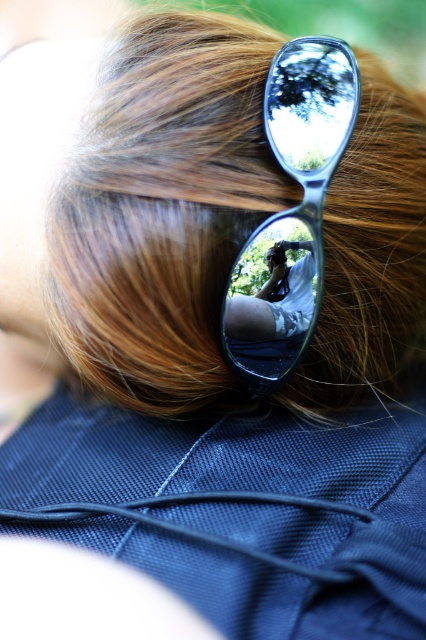
You are a photographer trying to adjust the lighting for a portrait. You notice the brown shiny hair at upper center and the metallic reflective sunglasses at center. Based on their positions, which object is closer to the left side of the frame?

The brown shiny hair at upper center is closer to the left side of the frame because it is positioned to the left of the metallic reflective sunglasses at center.

You are a photographer trying to capture the reflection in the metallic reflective sunglasses at center. The brown shiny hair at upper center is blocking part of the sunglasses. Can you adjust your position to avoid the hair blocking the reflection?

The brown shiny hair at upper center is larger in size than the metallic reflective sunglasses at center, so moving your position slightly downward or to the side might help avoid the hair blocking the reflection.

Looking at this image, you are a photographer trying to adjust the lighting for a portrait. You notice a point marked at coordinates (164, 211) on the image. Based on the scene description, what object is located at this point?

The point at coordinates 0.387, 0.387 marks the brown shiny hair at upper center.